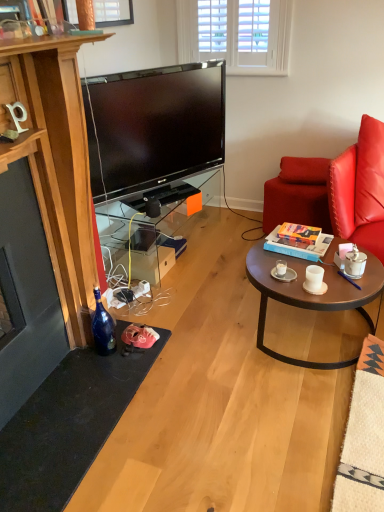
Where is `free spot to the left of purple plastic pen at coffee table`? free spot to the left of purple plastic pen at coffee table is located at coordinates (334, 285).